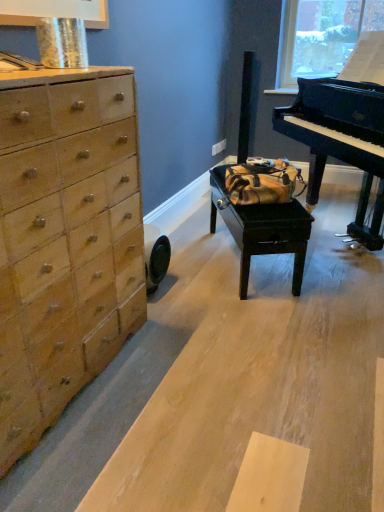
Find the location of a particular element. This screenshot has width=384, height=512. free space in front of wooden table at center is located at coordinates (257, 320).